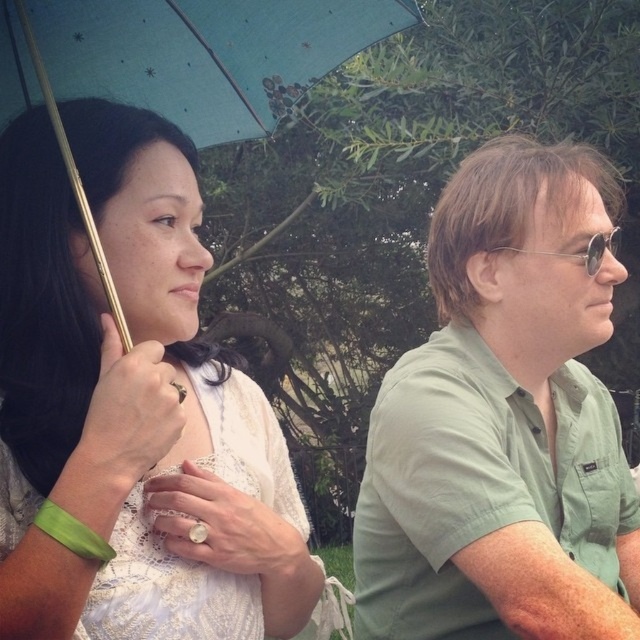
What do you see at coordinates (504, 420) in the screenshot? I see `green cotton shirt at right` at bounding box center [504, 420].

Can you confirm if green cotton shirt at right is positioned above white lace dress at upper left?

Yes, green cotton shirt at right is above white lace dress at upper left.

Between point (579, 628) and point (104, 522), which one is positioned behind?

Positioned behind is point (579, 628).

Identify the location of green cotton shirt at right. The height and width of the screenshot is (640, 640). (504, 420).

How far apart are white lace dress at upper left and blue fabric umbrella at upper left?

white lace dress at upper left is 23.54 centimeters away from blue fabric umbrella at upper left.

Is white lace dress at upper left to the right of blue fabric umbrella at upper left from the viewer's perspective?

In fact, white lace dress at upper left is to the left of blue fabric umbrella at upper left.

The image size is (640, 640). What do you see at coordinates (113, 337) in the screenshot?
I see `white lace dress at upper left` at bounding box center [113, 337].

Image resolution: width=640 pixels, height=640 pixels. What are the coordinates of `white lace dress at upper left` in the screenshot? It's located at (113, 337).

Does green cotton shirt at right have a smaller size compared to blue fabric umbrella at upper left?

Actually, green cotton shirt at right might be larger than blue fabric umbrella at upper left.

What do you see at coordinates (504, 420) in the screenshot? I see `green cotton shirt at right` at bounding box center [504, 420].

At what (x,y) coordinates should I click in order to perform the action: click on green cotton shirt at right. Please return your answer as a coordinate pair (x, y). Image resolution: width=640 pixels, height=640 pixels. Looking at the image, I should click on (504, 420).